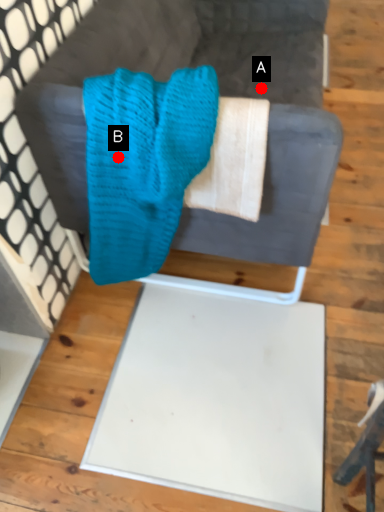
Question: Two points are circled on the image, labeled by A and B beside each circle. Which point is closer to the camera taking this photo?

Choices:
 (A) A is closer
 (B) B is closer

Answer: (B)